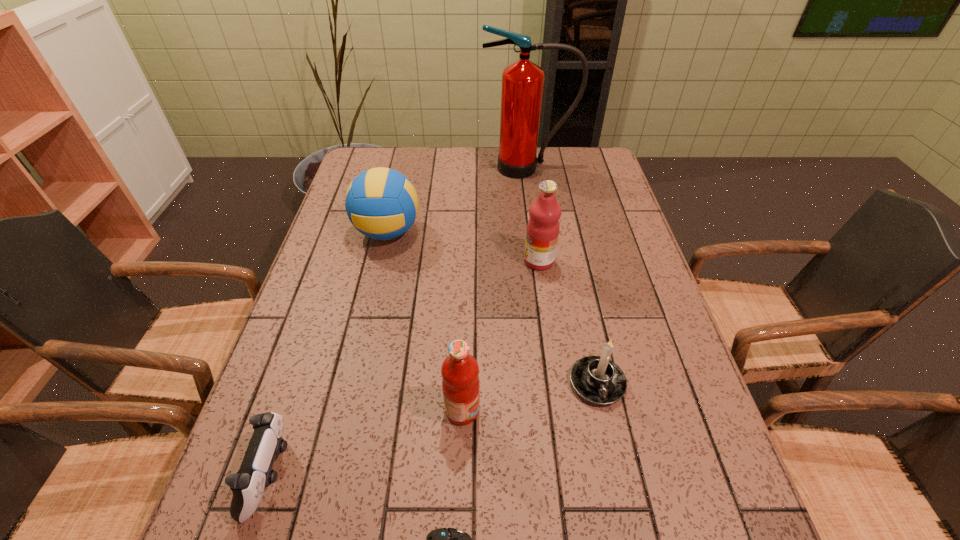
The image size is (960, 540). I want to click on free space located 0.380m on the label of the right fruit juice, so click(387, 261).

The height and width of the screenshot is (540, 960). I want to click on free space located 0.090m on the label of the right fruit juice, so click(x=492, y=261).

Find the location of a particular element. This screenshot has width=960, height=540. vacant space positioned 0.250m on the label of the right fruit juice is located at coordinates (434, 261).

What are the coordinates of `vacant space situated 0.280m on the front label of the nearer fruit juice` in the screenshot? It's located at (616, 410).

Locate an element on the screen. This screenshot has height=540, width=960. vacant area situated 0.380m on the back of the volleyball is located at coordinates (407, 151).

Where is `free space located with a handle on the side of the third shortest object`? This screenshot has height=540, width=960. free space located with a handle on the side of the third shortest object is located at coordinates (620, 490).

Identify the location of vacant region located 0.230m on the front-facing side of the control. The width and height of the screenshot is (960, 540). (415, 474).

Find the location of a particular element. object present at the far edge is located at coordinates (522, 82).

Where is `volleyball at the left edge`? Image resolution: width=960 pixels, height=540 pixels. volleyball at the left edge is located at coordinates (381, 203).

This screenshot has width=960, height=540. Find the location of `control at the left edge`. control at the left edge is located at coordinates pos(255,474).